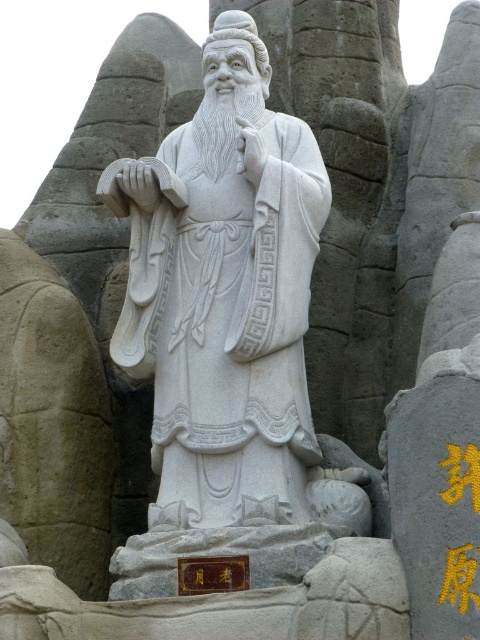
You are an art conservator assessing the dimensions of two sculptures in the image. The white marble statue at center and the white stone carving at center are both central to the composition. Which one has a greater width?

The white marble statue at center has a greater width than the white stone carving at center according to the description.

Consider the image. You are an art conservator examining the statue from the front. You notice two points on the statue marked as point 1 at coordinates point (229, 332) and point 2 at coordinates point (252, 282). Which point is closer to your viewpoint?

Point (229, 332) is closer to the camera than point (252, 282).